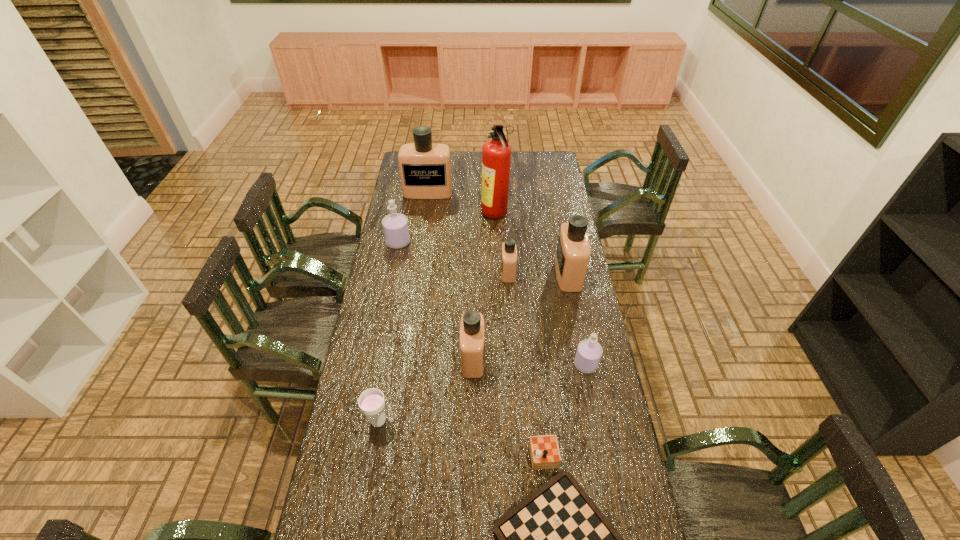
Identify the location of the nearer purple perfume. The height and width of the screenshot is (540, 960). (589, 351).

This screenshot has width=960, height=540. Identify the location of the right purple perfume. (589, 351).

Find the location of a particular element. Image resolution: width=960 pixels, height=540 pixels. the fourth perfume from left to right is located at coordinates (509, 249).

Where is `the second beige perfume from right to left`? Image resolution: width=960 pixels, height=540 pixels. the second beige perfume from right to left is located at coordinates (509, 249).

What are the coordinates of `the eighth farthest object` in the screenshot? It's located at (372, 403).

Locate an element on the screen. purple cup is located at coordinates (372, 403).

Find the location of a particular element. blank area located on the front-facing side of the second farthest object is located at coordinates (471, 215).

Where is `free space located on the front-facing side of the second farthest object`? This screenshot has width=960, height=540. free space located on the front-facing side of the second farthest object is located at coordinates (416, 215).

The height and width of the screenshot is (540, 960). I want to click on vacant space located 0.130m on the front-facing side of the second farthest object, so click(455, 215).

At what (x,y) coordinates should I click in order to perform the action: click on free space located 0.170m on the front label of the farthest object. Please return your answer as a coordinate pair (x, y). This screenshot has width=960, height=540. Looking at the image, I should click on (424, 220).